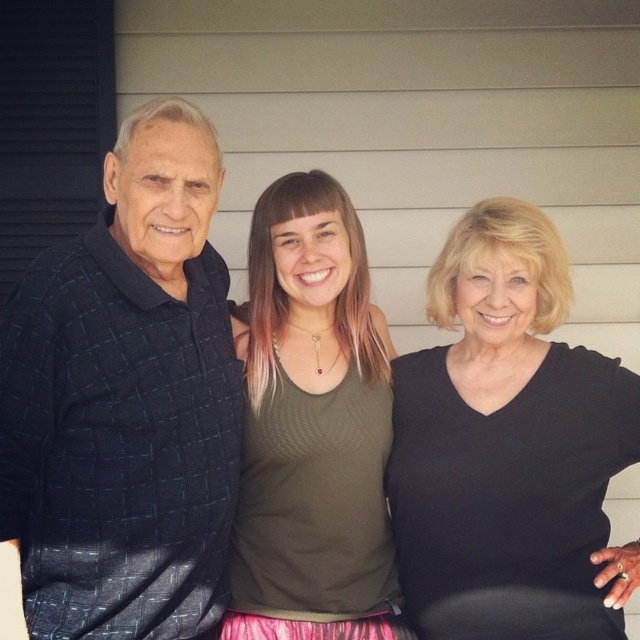
Question: Which point appears closest to the camera in this image?

Choices:
 (A) (534, 499)
 (B) (195, 344)
 (C) (372, 352)

Answer: (B)

Question: Does dark blue textured polo shirt at left appear under green fabric tank top at center?

Choices:
 (A) yes
 (B) no

Answer: (B)

Question: Which point appears farthest from the camera in this image?

Choices:
 (A) (592, 401)
 (B) (83, 406)
 (C) (372, 349)

Answer: (C)

Question: Estimate the real-world distances between objects in this image. Which object is closer to the green fabric tank top at center?

Choices:
 (A) dark blue textured polo shirt at left
 (B) black matte shirt at right

Answer: (B)

Question: Does black matte shirt at right appear on the right side of green fabric tank top at center?

Choices:
 (A) no
 (B) yes

Answer: (B)

Question: Does black matte shirt at right lie behind green fabric tank top at center?

Choices:
 (A) yes
 (B) no

Answer: (B)